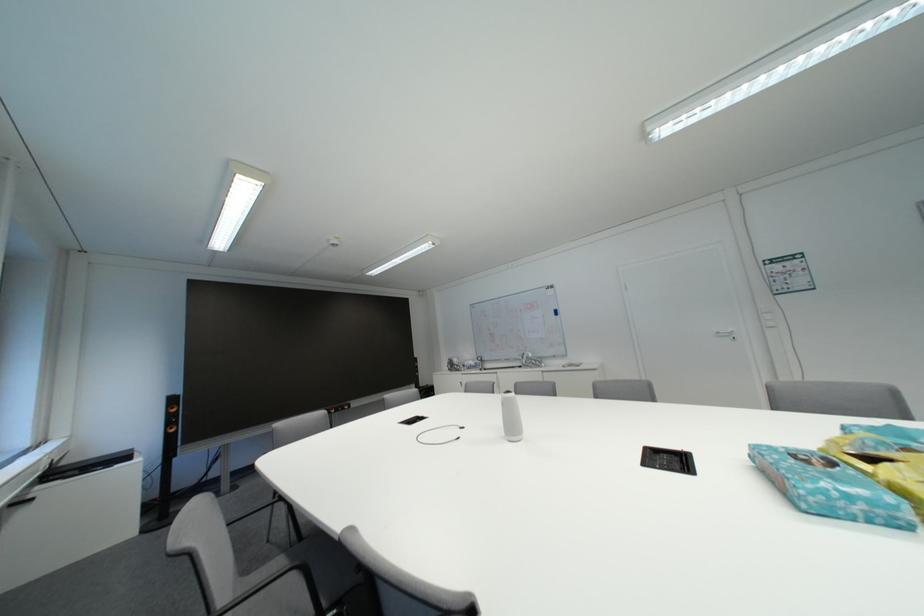
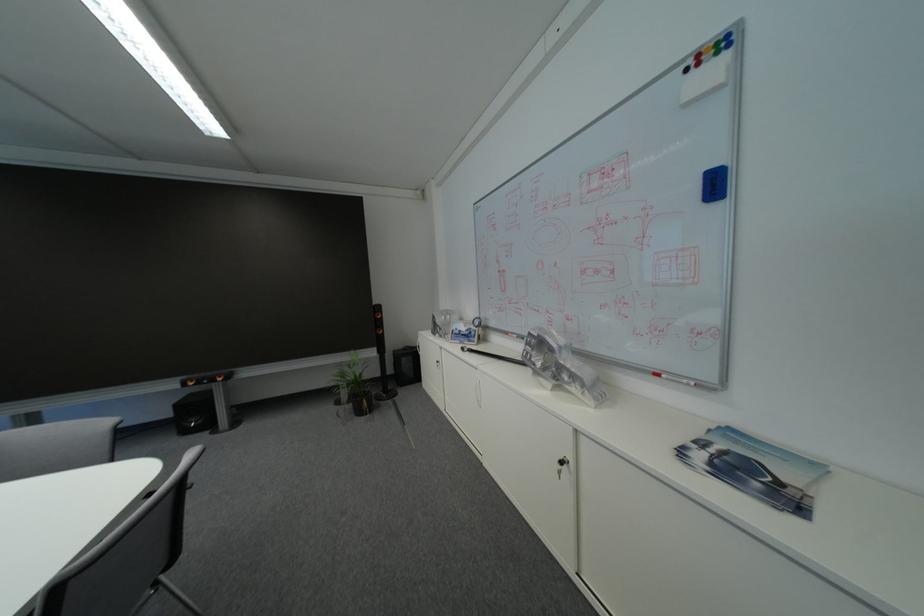
Locate, in the second image, the point that corresponds to point (565, 315) in the first image.

(726, 188)